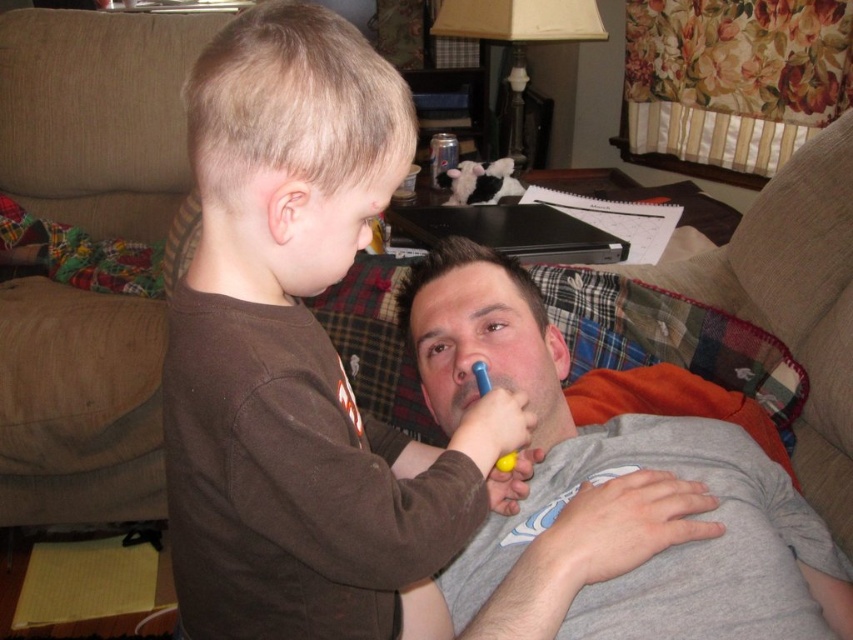
You are standing in the living room and want to reach the point marked at coordinates [321,636]. If your current position is 26.21 inches away from that point, can you move forward directly to reach it without any obstacles?

Yes, since the distance between you and the point is 26.21 inches, you can move forward directly to reach it as there are no obstacles mentioned in the scene description.

What are the coordinates of the beige fabric couch at upper left?

The beige fabric couch at upper left is located at coordinates point (97, 115).

You are a guest in the living room and want to sit down. The beige fabric couch at upper left and the gray cotton shirt at center are both in your line of sight. Which one is positioned higher from the ground?

The beige fabric couch at upper left is located above the gray cotton shirt at center, so it is positioned higher from the ground.